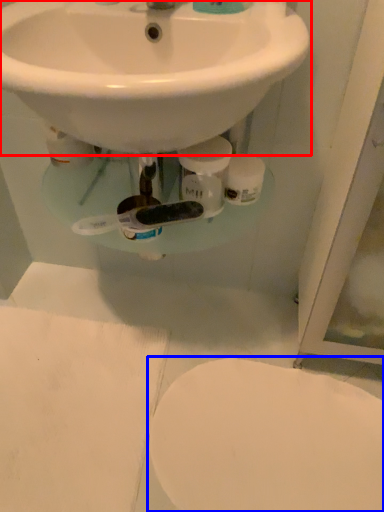
Question: Which of the following is the closest to the observer, sink (highlighted by a red box) or toilet (highlighted by a blue box)?

Choices:
 (A) sink
 (B) toilet

Answer: (A)